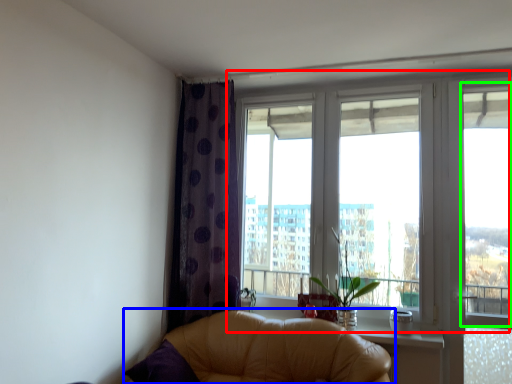
Question: Which object is the closest to the window (highlighted by a red box)? Choose among these: studio couch (highlighted by a blue box) or window screen (highlighted by a green box).

Choices:
 (A) studio couch
 (B) window screen

Answer: (B)